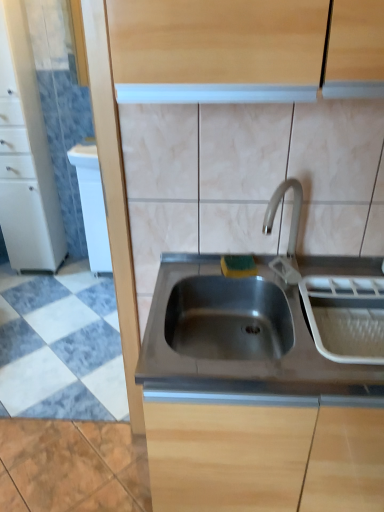
Where is `blank space situated above white marble floor at lower left (from a real-world perspective)`? blank space situated above white marble floor at lower left (from a real-world perspective) is located at coordinates (62, 324).